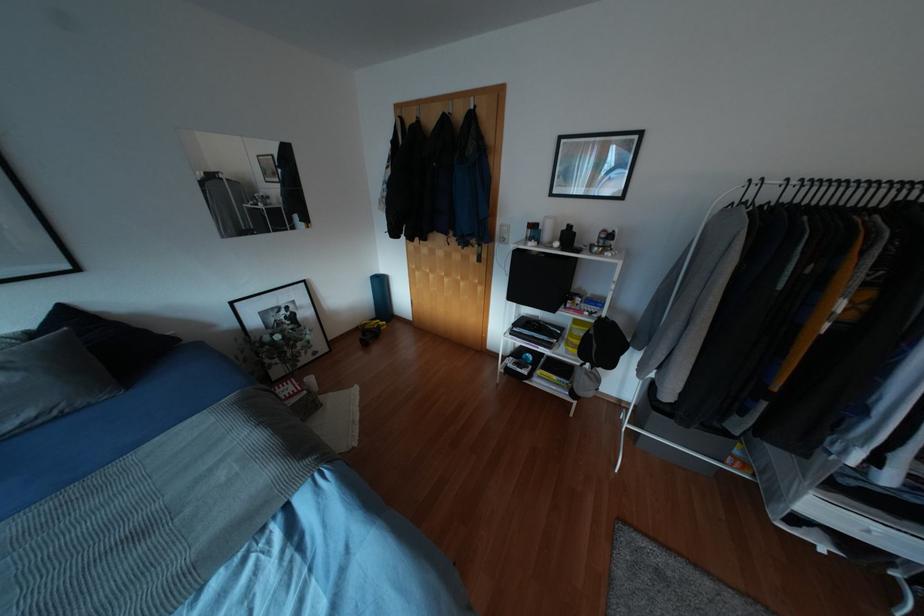
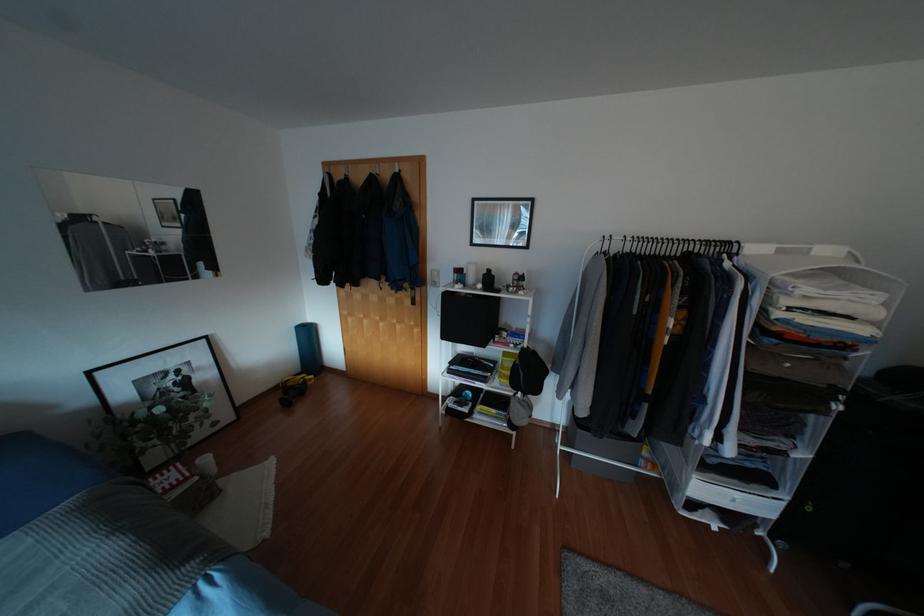
In the second image, find the point that corresponds to (x=868, y=532) in the first image.

(734, 500)